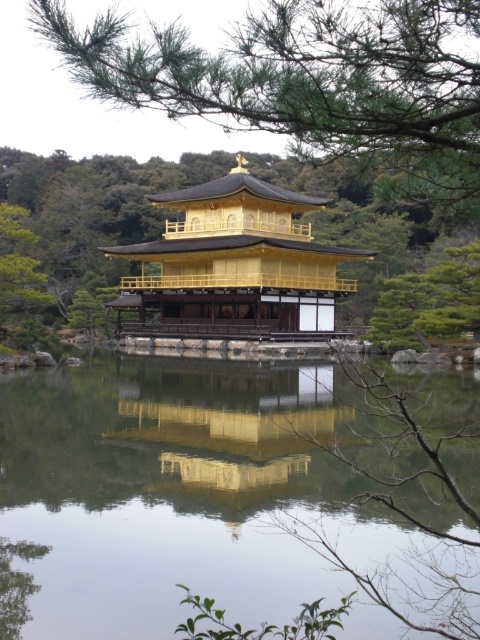
At what (x,y) coordinates should I click in order to perform the action: click on green leafy branch at upper center. Please return your answer as a coordinate pair (x, y). Looking at the image, I should click on (310, 84).

Between point (118, 99) and point (214, 362), which one is positioned in front?

Positioned in front is point (118, 99).

Locate an element on the screen. This screenshot has width=480, height=640. green leafy branch at upper center is located at coordinates (310, 84).

Does transparent glass lake at center have a lesser height compared to green leafy tree at left?

Correct, transparent glass lake at center is not as tall as green leafy tree at left.

This screenshot has width=480, height=640. What are the coordinates of `transparent glass lake at center` in the screenshot? It's located at (175, 492).

Is point (454, 394) positioned in front of point (0, 211)?

Yes, it is in front of point (0, 211).

The width and height of the screenshot is (480, 640). I want to click on transparent glass lake at center, so click(175, 492).

In the scene shown: Who is higher up, gold lacquered pagoda at center or green leafy tree at left?

gold lacquered pagoda at center is higher up.

Is point (227, 250) positioned before point (28, 275)?

No, (227, 250) is behind (28, 275).

Is point (325, 304) less distant than point (25, 339)?

No.

In order to click on gold lacquered pagoda at center in this screenshot , I will do `click(233, 266)`.